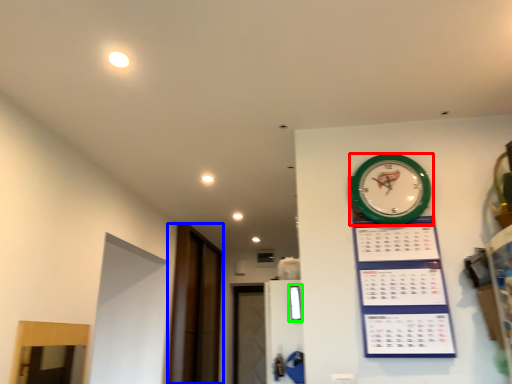
Question: Estimate the real-world distances between objects in this image. Which object is farther from wall clock (highlighted by a red box), glass door (highlighted by a blue box) or window (highlighted by a green box)?

Choices:
 (A) glass door
 (B) window

Answer: (A)